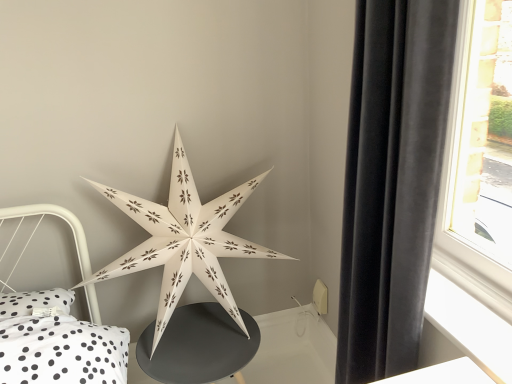
What is the approximate height of white paper star at center?

The height of white paper star at center is 36.89 inches.

The image size is (512, 384). What do you see at coordinates (392, 181) in the screenshot?
I see `velvet black curtain at right` at bounding box center [392, 181].

At what (x,y) coordinates should I click in order to perform the action: click on matte black table at center. Please return your answer as a coordinate pair (x, y). Image resolution: width=512 pixels, height=384 pixels. Looking at the image, I should click on (198, 345).

Looking at this image, in terms of size, does velvet black curtain at right appear bigger or smaller than matte black table at center?

velvet black curtain at right is bigger than matte black table at center.

Considering the relative sizes of velvet black curtain at right and matte black table at center in the image provided, is velvet black curtain at right taller than matte black table at center?

Indeed, velvet black curtain at right has a greater height compared to matte black table at center.

Identify the location of table below the white paper star at center (from the image's perspective). (198, 345).

Which of these two, white paper star at center or matte black table at center, is wider?

matte black table at center.

Considering the positions of point (193, 240) and point (185, 347), is point (193, 240) closer or farther from the camera than point (185, 347)?

Point (193, 240) appears to be closer to the viewer than point (185, 347).

Is white paper star at center not close to matte black table at center?

No, white paper star at center is in close proximity to matte black table at center.

From the image's perspective, which one is positioned higher, white paper star at center or velvet black curtain at right?

velvet black curtain at right, from the image's perspective.

Image resolution: width=512 pixels, height=384 pixels. In order to click on curtain above the white paper star at center (from the image's perspective) in this screenshot , I will do `click(392, 181)`.

Considering the relative positions of white paper star at center and velvet black curtain at right in the image provided, is white paper star at center to the right of velvet black curtain at right from the viewer's perspective?

Incorrect, white paper star at center is not on the right side of velvet black curtain at right.

What's the angular difference between white paper star at center and velvet black curtain at right's facing directions?

The facing directions of white paper star at center and velvet black curtain at right are 87.8 degrees apart.

Is velvet black curtain at right positioned far away from white paper star at center?

Actually, velvet black curtain at right and white paper star at center are a little close together.

Is point (382, 197) closer or farther from the camera than point (122, 263)?

Point (382, 197) is closer to the camera than point (122, 263).

Which object is positioned more to the right, velvet black curtain at right or white paper star at center?

velvet black curtain at right.

Is velvet black curtain at right positioned with its back to white paper star at center?

No, white paper star at center is not at the back of velvet black curtain at right.

Is matte black table at center located outside white paper star at center?

Absolutely, matte black table at center is external to white paper star at center.

Is the position of matte black table at center more distant than that of white paper star at center?

Yes, matte black table at center is further from the viewer.

Looking at this image, can you confirm if matte black table at center is taller than white paper star at center?

Incorrect, the height of matte black table at center is not larger of that of white paper star at center.

Is white paper star at center at the back of matte black table at center?

No, white paper star at center is not at the back of matte black table at center.

From the image's perspective, is matte black table at center on top of velvet black curtain at right?

No, from the image's perspective, matte black table at center is not on top of velvet black curtain at right.

Is matte black table at center facing towards velvet black curtain at right?

No, matte black table at center is not aimed at velvet black curtain at right.

You are a GUI agent. You are given a task and a screenshot of the screen. Output one action in this format:
    pyautogui.click(x=<x>, y=<y>)
    Task: Click on the table behind the velvet black curtain at right
    
    Given the screenshot: What is the action you would take?
    click(198, 345)

Does matte black table at center have a greater width compared to velvet black curtain at right?

Indeed, matte black table at center has a greater width compared to velvet black curtain at right.

You are a GUI agent. You are given a task and a screenshot of the screen. Output one action in this format:
    pyautogui.click(x=<x>, y=<y>)
    Task: Click on the curtain in front of the matte black table at center
    This screenshot has height=384, width=512.
    Given the screenshot: What is the action you would take?
    (392, 181)

Where is `table behind the white paper star at center`? This screenshot has width=512, height=384. table behind the white paper star at center is located at coordinates click(198, 345).

Estimate the real-world distances between objects in this image. Which object is closer to velvet black curtain at right, matte black table at center or white paper star at center?

white paper star at center lies closer to velvet black curtain at right than the other object.

Estimate the real-world distances between objects in this image. Which object is closer to white paper star at center, matte black table at center or velvet black curtain at right?

matte black table at center.

Which object lies nearer to the anchor point velvet black curtain at right, white paper star at center or matte black table at center?

white paper star at center lies closer to velvet black curtain at right than the other object.

Considering their positions, is velvet black curtain at right positioned closer to white paper star at center than matte black table at center?

matte black table at center is positioned closer to the anchor white paper star at center.

Looking at the image, which one is located further to matte black table at center, white paper star at center or velvet black curtain at right?

The object further to matte black table at center is velvet black curtain at right.

Estimate the real-world distances between objects in this image. Which object is further from matte black table at center, velvet black curtain at right or white paper star at center?

velvet black curtain at right is positioned further to the anchor matte black table at center.

This screenshot has height=384, width=512. In order to click on table between white paper star at center and velvet black curtain at right in this screenshot , I will do `click(198, 345)`.